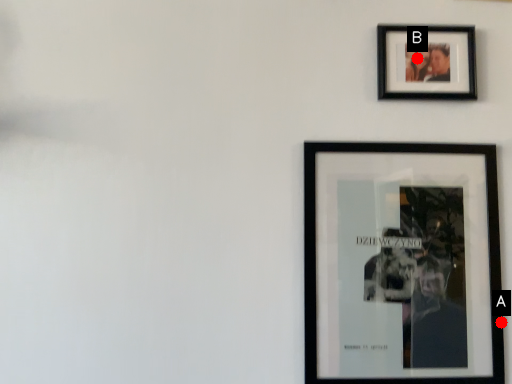
Question: Two points are circled on the image, labeled by A and B beside each circle. Which point is closer to the camera?

Choices:
 (A) A is closer
 (B) B is closer

Answer: (A)